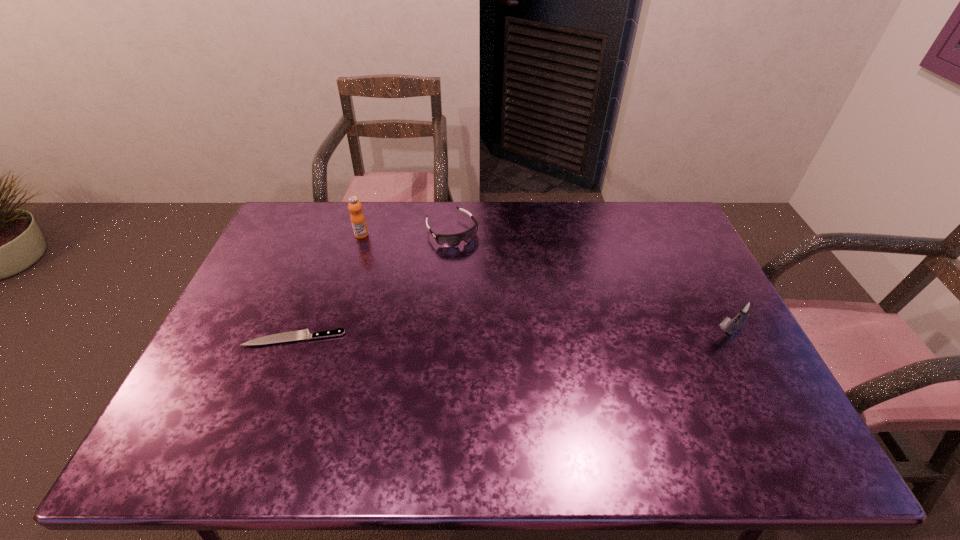
Locate an element on the screen. This screenshot has height=540, width=960. vacant space on the desktop that is between the shortest object and the igniter and is positioned on the front and sides of the third tallest object is located at coordinates (530, 336).

This screenshot has height=540, width=960. I want to click on vacant space on the desktop that is between the steak knife and the rightmost object and is positioned on the front label of the tallest object, so click(493, 336).